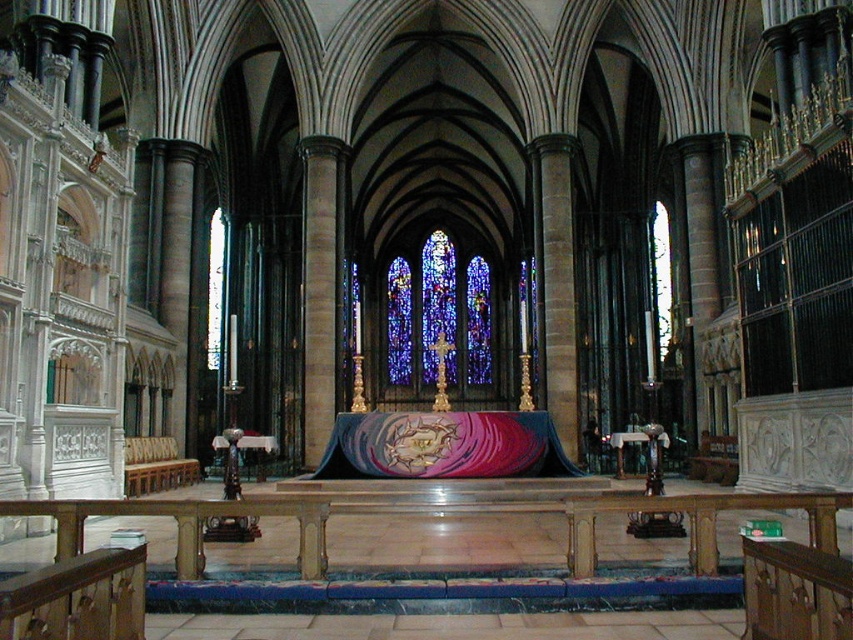
You are an architect visiting the cathedral and need to determine the relative heights of the stained glass at center and the wooden polished bench at lower left. Based on the scene, which object is taller?

The stained glass at center is taller than the wooden polished bench at lower left.